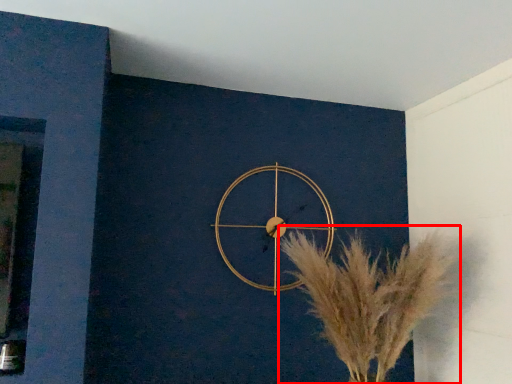
Question: From the image's perspective, considering the relative positions of flower (annotated by the red box) and wall clock in the image provided, where is flower (annotated by the red box) located with respect to the staircase?

Choices:
 (A) above
 (B) below

Answer: (B)